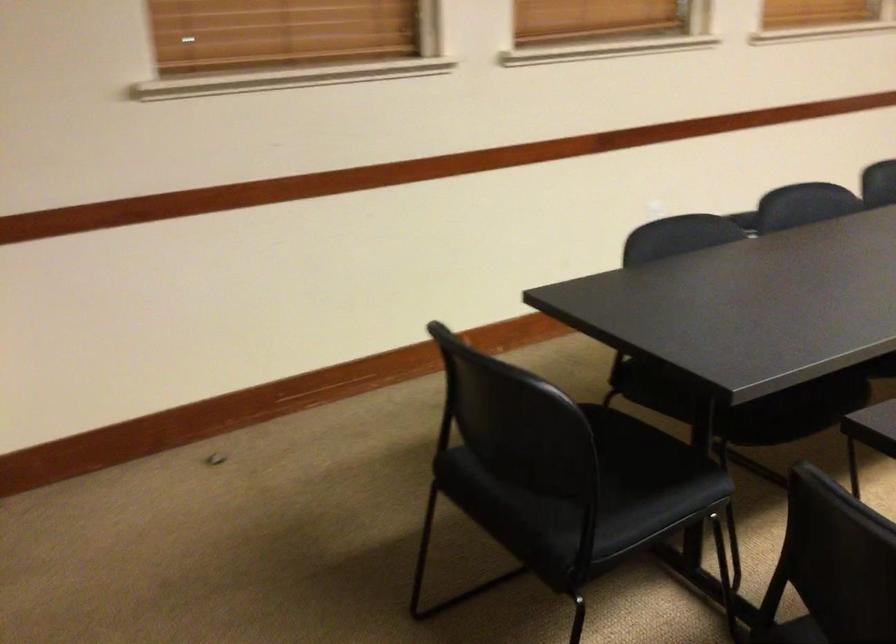
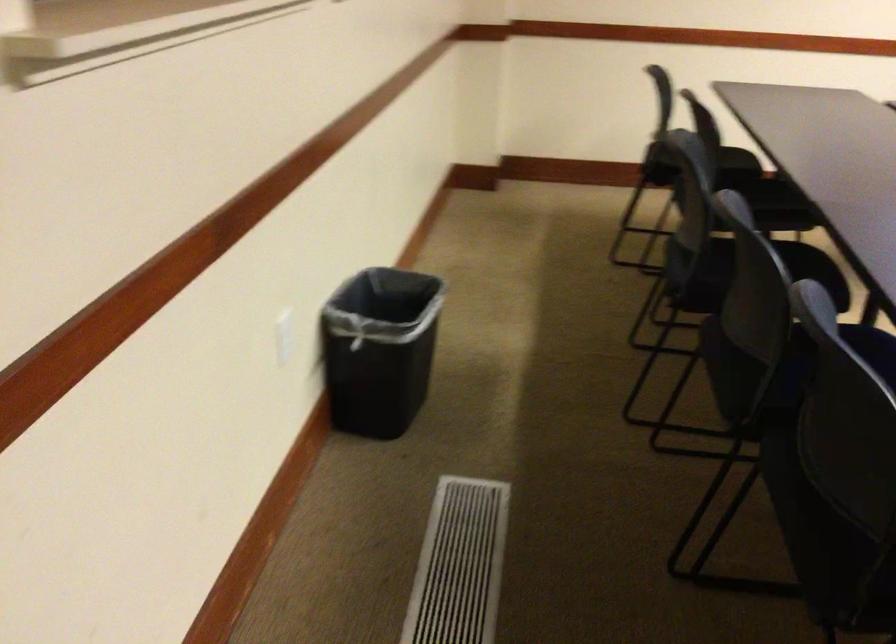
The images are taken continuously from a first-person perspective. In which direction is your viewpoint rotating?

The camera's rotation is toward right-down.